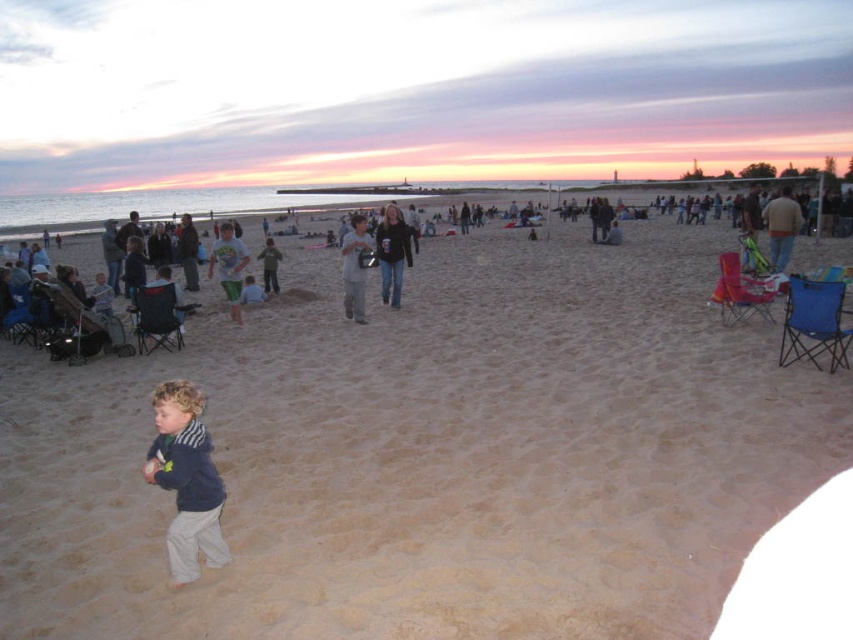
Question: Which point appears closest to the camera in this image?

Choices:
 (A) (268, 260)
 (B) (387, 211)

Answer: (B)

Question: Estimate the real-world distances between objects in this image. Which object is farther from the dark blue fleece jacket at lower left?

Choices:
 (A) light beige sand at center
 (B) light gray cotton shirt at center
 (C) white cotton shirt at center
 (D) black matte jacket at center

Answer: (D)

Question: Does black matte jacket at center come in front of camouflage pants at center?

Choices:
 (A) no
 (B) yes

Answer: (B)

Question: Can you confirm if white cotton shirt at center is smaller than camouflage pants at center?

Choices:
 (A) no
 (B) yes

Answer: (A)

Question: Does dark blue fleece jacket at lower left have a larger size compared to black matte jacket at center?

Choices:
 (A) yes
 (B) no

Answer: (B)

Question: Which point is farther to the camera?

Choices:
 (A) (193, 500)
 (B) (672, 618)
 (C) (352, 225)
 (D) (238, 256)

Answer: (C)